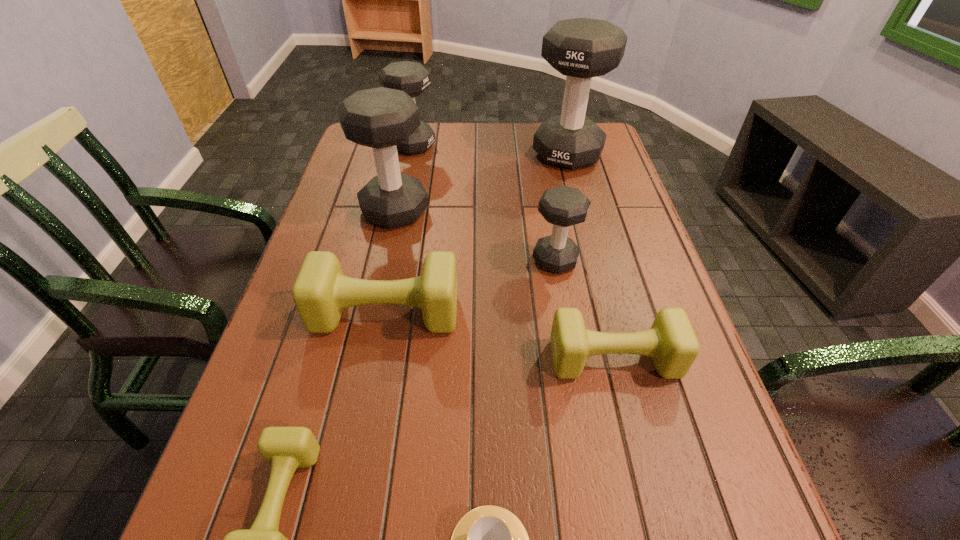
Locate an element on the screen. This screenshot has width=960, height=540. the third closest dumbbell to the smallest olive dumbbell is located at coordinates (381, 118).

Where is `dumbbell that stands as the fifth closest to the seventh shortest object`? Image resolution: width=960 pixels, height=540 pixels. dumbbell that stands as the fifth closest to the seventh shortest object is located at coordinates click(x=671, y=342).

What are the coordinates of `the fourth closest gray dumbbell to the cup` in the screenshot? It's located at (413, 78).

You are a GUI agent. You are given a task and a screenshot of the screen. Output one action in this format:
    pyautogui.click(x=<x>, y=<y>)
    Task: Click on the gray dumbbell that is the fourth closest to the fifth farthest object
    Image resolution: width=960 pixels, height=540 pixels.
    Given the screenshot: What is the action you would take?
    pyautogui.click(x=413, y=78)

Identify which olive dumbbell is the third closest to the tallest object. Please provide its 2D coordinates. Your answer should be formatted as a tuple, i.e. [(x, y)], where the tuple contains the x and y coordinates of a point satisfying the conditions above.

[(285, 448)]

Where is `olive dumbbell that is the closest to the rightmost olive dumbbell`? The width and height of the screenshot is (960, 540). olive dumbbell that is the closest to the rightmost olive dumbbell is located at coordinates (320, 293).

Find the location of a particular element. The height and width of the screenshot is (540, 960). free space that satisfies the following two spatial constraints: 1. on the front side of the second nearest olive dumbbell; 2. on the left side of the fifth shortest dumbbell is located at coordinates (369, 359).